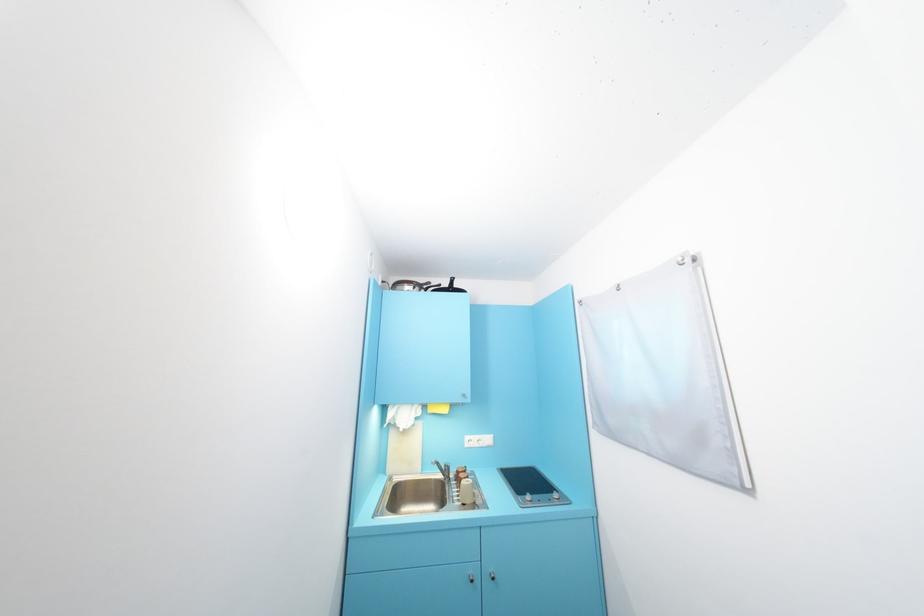
The width and height of the screenshot is (924, 616). What do you see at coordinates (554, 495) in the screenshot? I see `the stovetop knob` at bounding box center [554, 495].